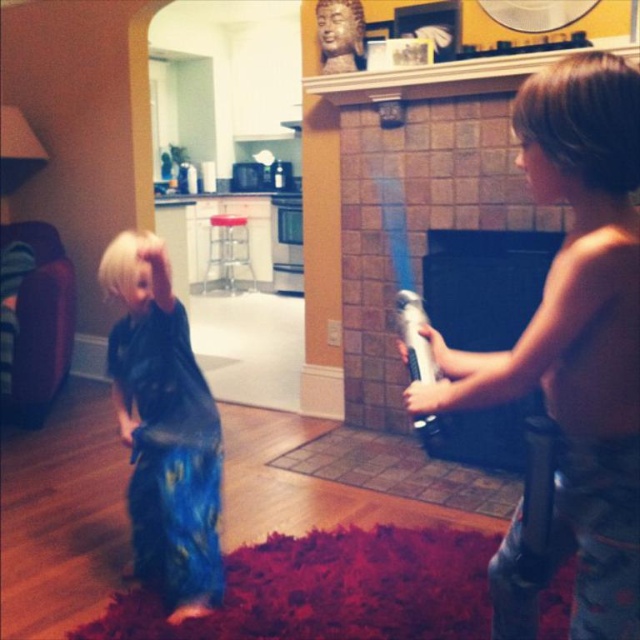
Question: Can you confirm if shiny metallic toy at right is positioned below transparent plastic water gun at right?

Choices:
 (A) no
 (B) yes

Answer: (B)

Question: Among these objects, which one is nearest to the camera?

Choices:
 (A) shiny metallic toy at right
 (B) black brick fireplace at center
 (C) blue sequined skirt at lower left
 (D) transparent plastic water gun at right

Answer: (A)

Question: Which of the following is the farthest from the observer?

Choices:
 (A) blue sequined skirt at lower left
 (B) shiny metallic toy at right
 (C) black brick fireplace at center
 (D) transparent plastic water gun at right

Answer: (C)

Question: From the image, what is the correct spatial relationship of shiny metallic toy at right in relation to black brick fireplace at center?

Choices:
 (A) below
 (B) above

Answer: (A)

Question: Is shiny metallic toy at right smaller than transparent plastic water gun at right?

Choices:
 (A) yes
 (B) no

Answer: (B)

Question: Which object appears closest to the camera in this image?

Choices:
 (A) transparent plastic water gun at right
 (B) blue sequined skirt at lower left
 (C) shiny metallic toy at right
 (D) black brick fireplace at center

Answer: (C)